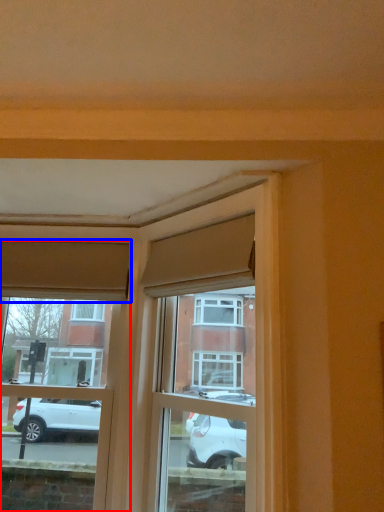
Question: Among these objects, which one is farthest to the camera, window (highlighted by a red box) or curtain (highlighted by a blue box)?

Choices:
 (A) window
 (B) curtain

Answer: (B)